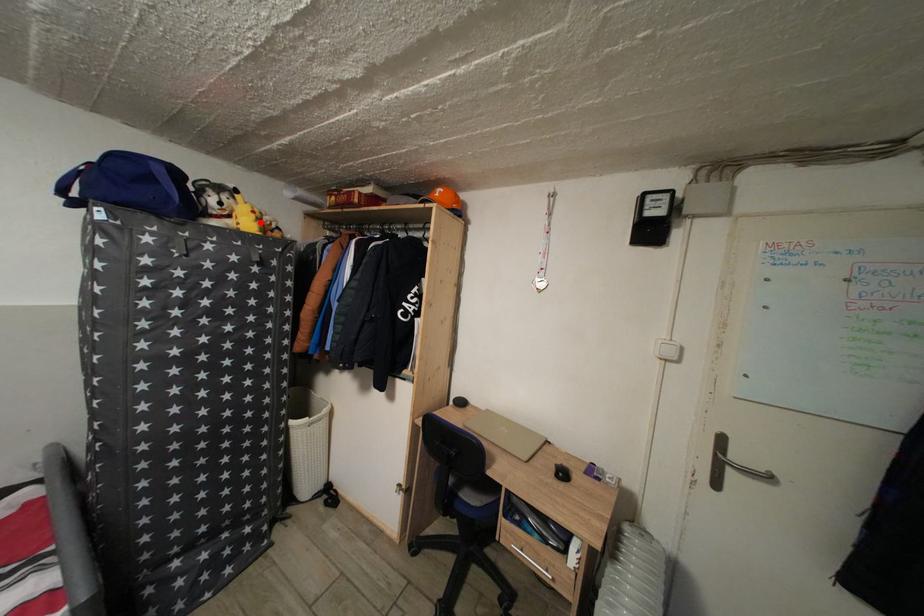
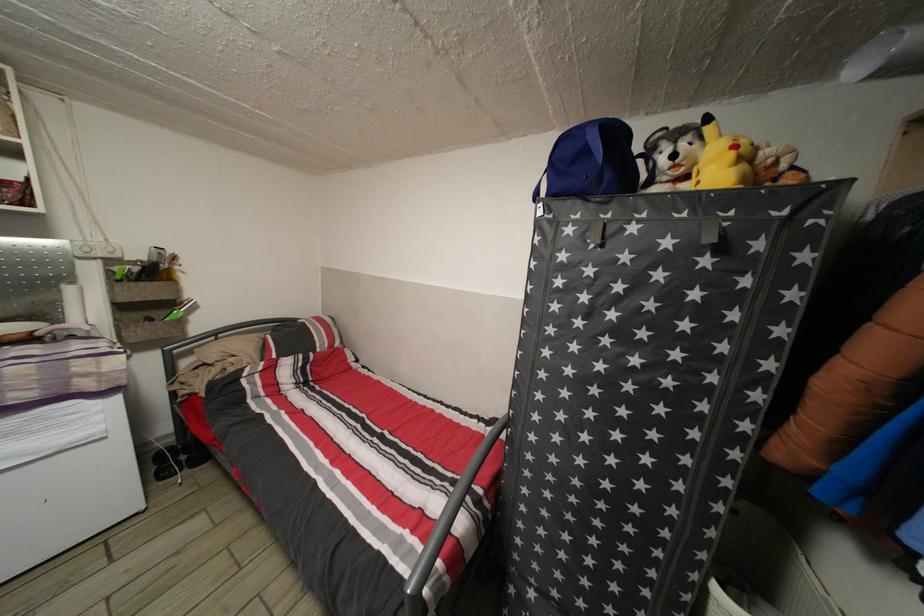
Where in the second image is the point corresponding to the highlighted location from the first image?

(738, 161)